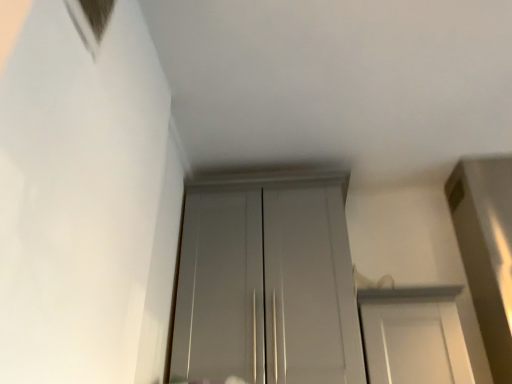
Where is `white glossy door at center, which is counted as the first door, starting from the right`? This screenshot has width=512, height=384. white glossy door at center, which is counted as the first door, starting from the right is located at coordinates (415, 343).

The width and height of the screenshot is (512, 384). Describe the element at coordinates (415, 343) in the screenshot. I see `white glossy door at center, which is counted as the first door, starting from the right` at that location.

Measure the distance between glossy white door at center, positioned as the second door in right-to-left order, and camera.

4.10 feet.

What is the approximate height of glossy white door at center, positioned as the second door in right-to-left order?

glossy white door at center, positioned as the second door in right-to-left order, is 30.15 inches in height.

The height and width of the screenshot is (384, 512). What do you see at coordinates (266, 280) in the screenshot?
I see `glossy white door at center, the first door in the left-to-right sequence` at bounding box center [266, 280].

Where is `glossy white door at center, positioned as the second door in right-to-left order`? glossy white door at center, positioned as the second door in right-to-left order is located at coordinates (266, 280).

Find the location of a particular element. Image resolution: width=512 pixels, height=384 pixels. white glossy door at center, which is counted as the first door, starting from the right is located at coordinates (415, 343).

Which object is positioned more to the left, glossy white door at center, the first door in the left-to-right sequence, or white glossy door at center, which is counted as the first door, starting from the right?

glossy white door at center, the first door in the left-to-right sequence, is more to the left.

In the image, is glossy white door at center, the first door in the left-to-right sequence, positioned in front of or behind white glossy door at center, which is counted as the second door, starting from the left?

glossy white door at center, the first door in the left-to-right sequence, is behind white glossy door at center, which is counted as the second door, starting from the left.

Does point (177, 328) lie in front of point (461, 343)?

No, it is not.

From the image's perspective, is glossy white door at center, the first door in the left-to-right sequence, under white glossy door at center, which is counted as the first door, starting from the right?

Incorrect, from the image's perspective, glossy white door at center, the first door in the left-to-right sequence, is higher than white glossy door at center, which is counted as the first door, starting from the right.

From a real-world perspective, who is located higher, glossy white door at center, the first door in the left-to-right sequence, or white glossy door at center, which is counted as the second door, starting from the left?

glossy white door at center, the first door in the left-to-right sequence.

Which of these two, glossy white door at center, the first door in the left-to-right sequence, or white glossy door at center, which is counted as the first door, starting from the right, is thinner?

glossy white door at center, the first door in the left-to-right sequence.

Does glossy white door at center, the first door in the left-to-right sequence, have a lesser height compared to white glossy door at center, which is counted as the first door, starting from the right?

No, glossy white door at center, the first door in the left-to-right sequence, is not shorter than white glossy door at center, which is counted as the first door, starting from the right.

Is glossy white door at center, the first door in the left-to-right sequence, bigger than white glossy door at center, which is counted as the first door, starting from the right?

Yes, glossy white door at center, the first door in the left-to-right sequence, is bigger than white glossy door at center, which is counted as the first door, starting from the right.

Is white glossy door at center, which is counted as the second door, starting from the left, inside glossy white door at center, the first door in the left-to-right sequence?

No, glossy white door at center, the first door in the left-to-right sequence, does not contain white glossy door at center, which is counted as the second door, starting from the left.

Is glossy white door at center, positioned as the second door in right-to-left order, far away from white glossy door at center, which is counted as the first door, starting from the right?

They are positioned close to each other.

From the picture: Is glossy white door at center, positioned as the second door in right-to-left order, turned away from white glossy door at center, which is counted as the first door, starting from the right?

glossy white door at center, positioned as the second door in right-to-left order, does not have its back to white glossy door at center, which is counted as the first door, starting from the right.

What's the angular difference between glossy white door at center, positioned as the second door in right-to-left order, and white glossy door at center, which is counted as the second door, starting from the left,'s facing directions?

They differ by 2.21 degrees in their facing directions.

How much distance is there between glossy white door at center, the first door in the left-to-right sequence, and white glossy door at center, which is counted as the second door, starting from the left?

glossy white door at center, the first door in the left-to-right sequence, and white glossy door at center, which is counted as the second door, starting from the left, are 29.74 centimeters apart from each other.

In order to click on door that appears in front of the glossy white door at center, positioned as the second door in right-to-left order in this screenshot , I will do `click(415, 343)`.

Considering the relative positions of white glossy door at center, which is counted as the second door, starting from the left, and glossy white door at center, positioned as the second door in right-to-left order, in the image provided, is white glossy door at center, which is counted as the second door, starting from the left, to the left or to the right of glossy white door at center, positioned as the second door in right-to-left order,?

In the image, white glossy door at center, which is counted as the second door, starting from the left, appears on the right side of glossy white door at center, positioned as the second door in right-to-left order.

Considering the positions of objects white glossy door at center, which is counted as the first door, starting from the right, and glossy white door at center, the first door in the left-to-right sequence, in the image provided, who is behind, white glossy door at center, which is counted as the first door, starting from the right, or glossy white door at center, the first door in the left-to-right sequence,?

glossy white door at center, the first door in the left-to-right sequence, is behind.

Considering the positions of point (419, 356) and point (289, 179), is point (419, 356) closer or farther from the camera than point (289, 179)?

Point (419, 356).

From the image's perspective, is white glossy door at center, which is counted as the second door, starting from the left, positioned above or below glossy white door at center, the first door in the left-to-right sequence?

From the image's perspective, white glossy door at center, which is counted as the second door, starting from the left, appears below glossy white door at center, the first door in the left-to-right sequence.

From a real-world perspective, between white glossy door at center, which is counted as the first door, starting from the right, and glossy white door at center, the first door in the left-to-right sequence, who is vertically lower?

white glossy door at center, which is counted as the first door, starting from the right, from a real-world perspective.

Which object is thinner, white glossy door at center, which is counted as the second door, starting from the left, or glossy white door at center, the first door in the left-to-right sequence?

With smaller width is glossy white door at center, the first door in the left-to-right sequence.

From the picture: Between white glossy door at center, which is counted as the first door, starting from the right, and glossy white door at center, positioned as the second door in right-to-left order, which one has less height?

white glossy door at center, which is counted as the first door, starting from the right, is shorter.

Considering the sizes of objects white glossy door at center, which is counted as the second door, starting from the left, and glossy white door at center, positioned as the second door in right-to-left order, in the image provided, who is smaller, white glossy door at center, which is counted as the second door, starting from the left, or glossy white door at center, positioned as the second door in right-to-left order,?

white glossy door at center, which is counted as the second door, starting from the left.

Choose the correct answer: Is white glossy door at center, which is counted as the second door, starting from the left, inside glossy white door at center, the first door in the left-to-right sequence, or outside it?

The correct answer is: outside.

From the picture: Can you see white glossy door at center, which is counted as the second door, starting from the left, touching glossy white door at center, the first door in the left-to-right sequence?

No, white glossy door at center, which is counted as the second door, starting from the left, is not making contact with glossy white door at center, the first door in the left-to-right sequence.

Does white glossy door at center, which is counted as the first door, starting from the right, turn towards glossy white door at center, the first door in the left-to-right sequence?

No, white glossy door at center, which is counted as the first door, starting from the right, does not turn towards glossy white door at center, the first door in the left-to-right sequence.

Can you tell me how much white glossy door at center, which is counted as the first door, starting from the right, and glossy white door at center, positioned as the second door in right-to-left order, differ in facing direction?

2.21 degrees separate the facing orientations of white glossy door at center, which is counted as the first door, starting from the right, and glossy white door at center, positioned as the second door in right-to-left order.

Image resolution: width=512 pixels, height=384 pixels. In order to click on door located in front of the glossy white door at center, the first door in the left-to-right sequence in this screenshot , I will do `click(415, 343)`.

Identify the location of door behind the white glossy door at center, which is counted as the first door, starting from the right. The height and width of the screenshot is (384, 512). (266, 280).

Find the location of a particular element. door that is on the left side of white glossy door at center, which is counted as the second door, starting from the left is located at coordinates (266, 280).